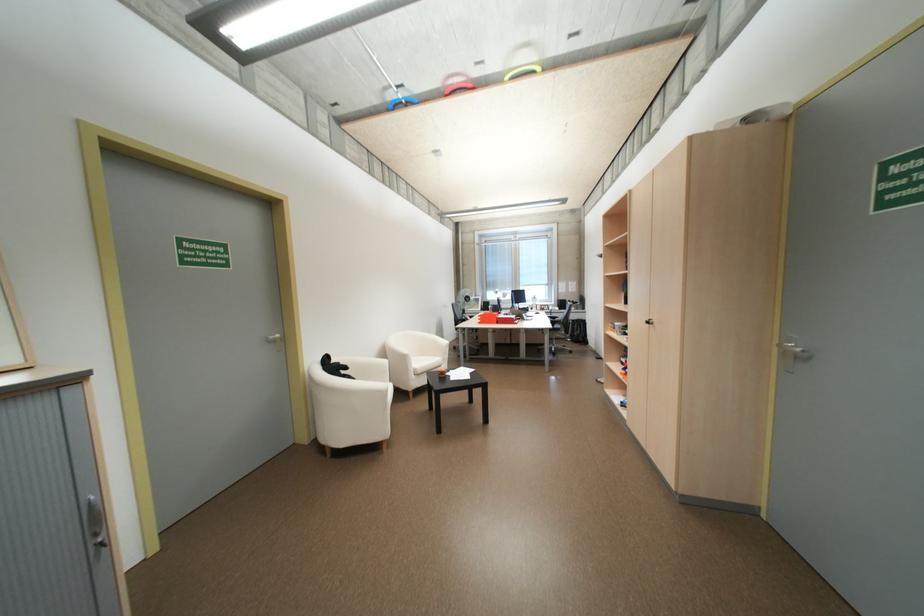
Where would you pull the black cabinet knob? Please return your answer as a coordinate pair (x, y).

(649, 322)